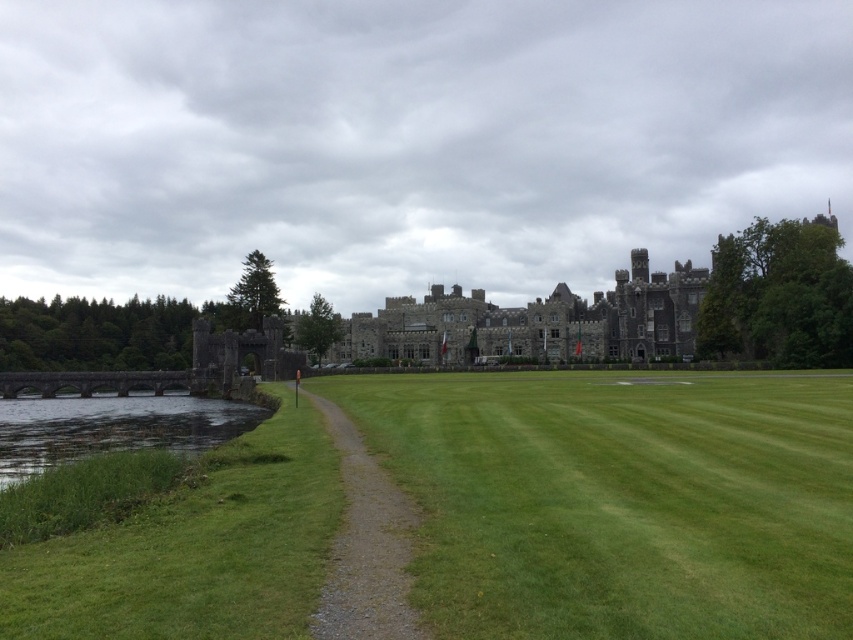
You are standing at point [619,500] in the scene. What is the terrain like at your current location?

The terrain at point [619,500] is green grass at center.

You are a tourist standing at the base of the castle path. You want to take a shortcut to the castle entrance by crossing the green grassy water at lower left. Is the green grass at center a better option for walking on?

The green grass at center is located above the green grassy water at lower left, so it is higher and more elevated. Therefore, the green grass at center is a better option for walking on as it is solid ground, while the green grassy water at lower left likely has water underneath the grass and may be unstable.

You are a tourist planning to walk from the lower left corner of the image towards the castle entrance. There is a gravel path at center and a green grassy water at lower left. Which path should you take to avoid getting your shoes wet?

The gravel path at center has a lesser width compared to green grassy water at lower left, so you should take the gravel path at center to avoid getting your shoes wet since the green grassy water at lower left might be a body of water that could wet your shoes.